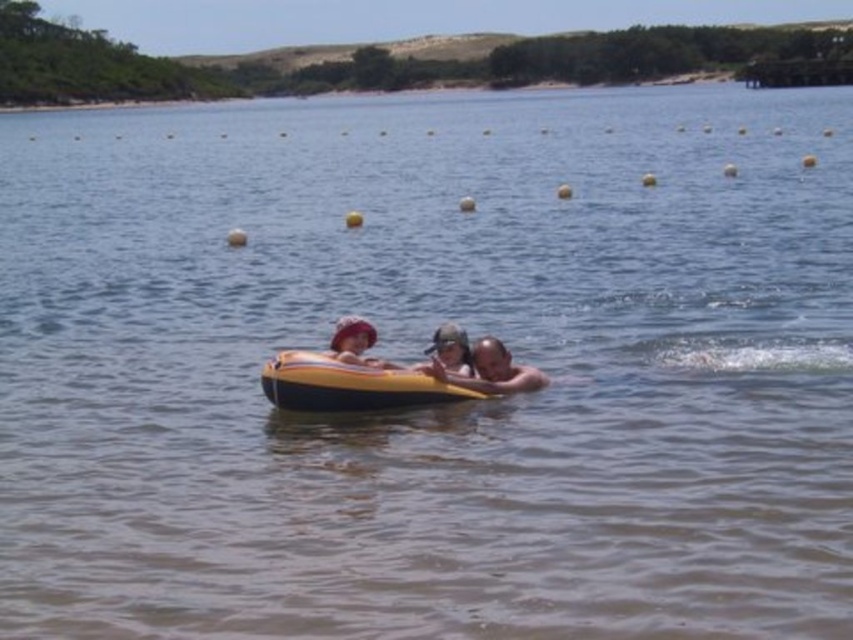
Question: Does smooth skin man at center have a greater width compared to matte yellow float at center?

Choices:
 (A) no
 (B) yes

Answer: (B)

Question: Does yellow rubber boat at center come behind matte yellow float at center?

Choices:
 (A) yes
 (B) no

Answer: (B)

Question: Which point is closer to the camera taking this photo?

Choices:
 (A) (341, 381)
 (B) (447, 378)
 (C) (367, 321)

Answer: (A)

Question: Considering the real-world distances, which object is closest to the smooth skin man at center?

Choices:
 (A) yellow rubber boat at center
 (B) matte yellow float at center

Answer: (A)

Question: Estimate the real-world distances between objects in this image. Which object is farther from the smooth skin man at center?

Choices:
 (A) yellow rubber boat at center
 (B) matte yellow float at center

Answer: (B)

Question: Is yellow rubber boat at center to the left of matte yellow float at center from the viewer's perspective?

Choices:
 (A) yes
 (B) no

Answer: (B)